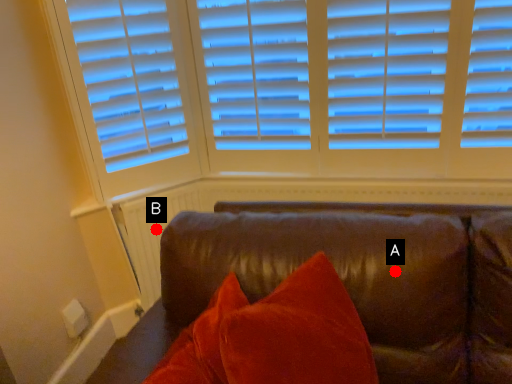
Question: Two points are circled on the image, labeled by A and B beside each circle. Which point is further to the camera?

Choices:
 (A) A is further
 (B) B is further

Answer: (B)